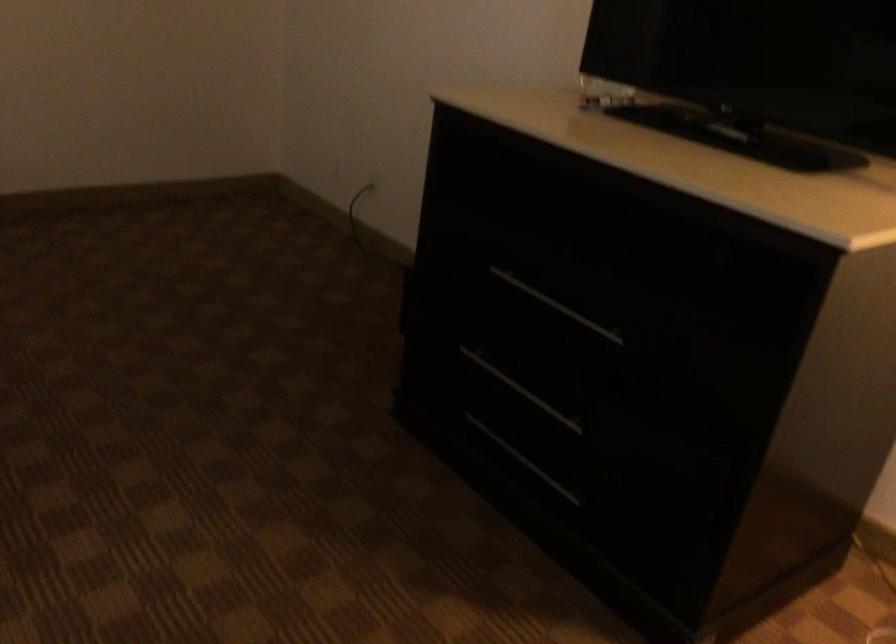
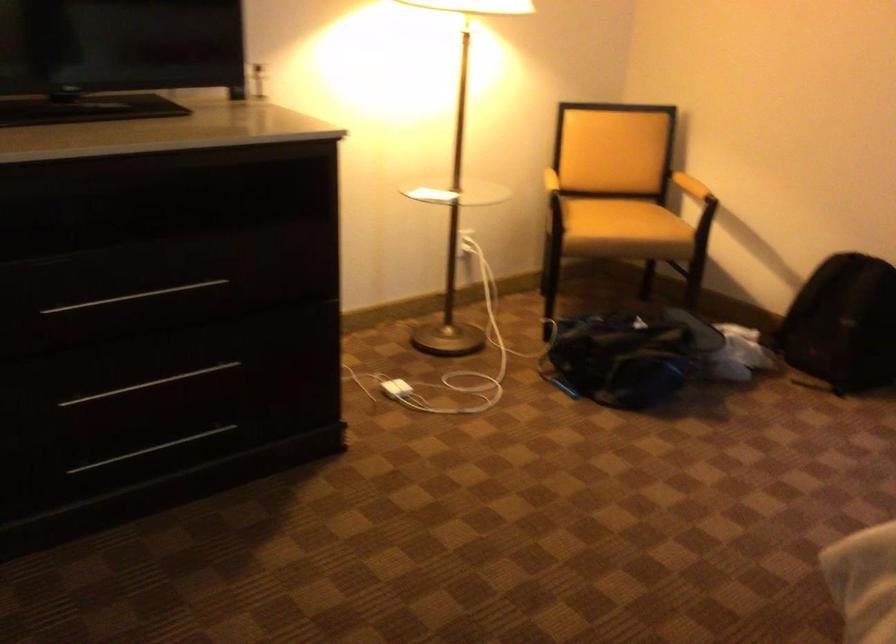
Locate, in the second image, the point that corresponds to [535,395] in the first image.

(149, 384)